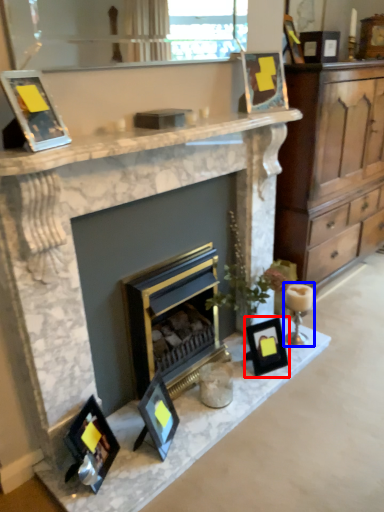
Question: Which of the following is the farthest to the observer, picture frame (highlighted by a red box) or candle holder (highlighted by a blue box)?

Choices:
 (A) picture frame
 (B) candle holder

Answer: (B)